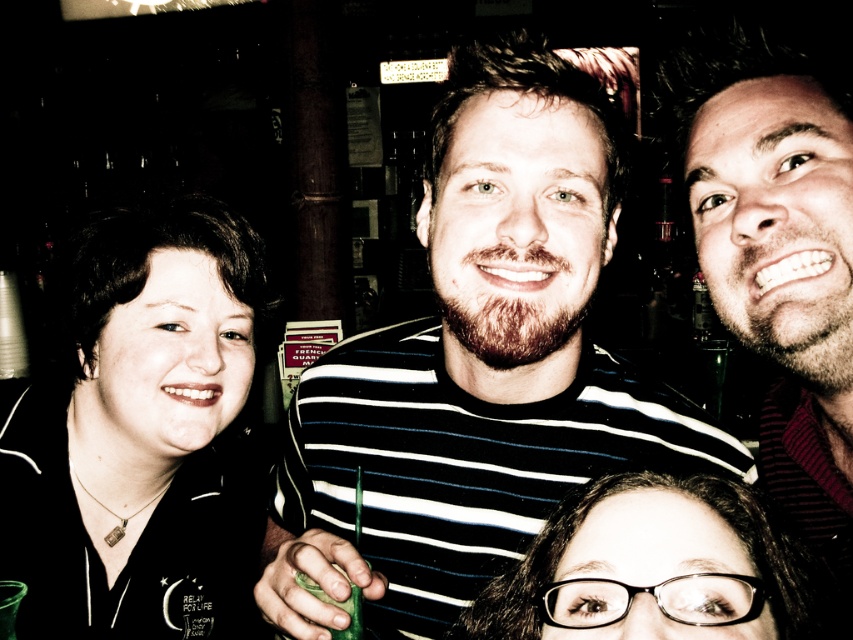
You are at a party and want to grab a drink. You see two glasses at the lower center of the table. The clear plastic glasses at lower center and the green matte glass at lower center. Which one is positioned higher and thus easier to reach?

The clear plastic glasses at lower center is above the green matte glass at lower center, so it is higher and easier to reach.

You are at a party and need to place a small decorative item on the table. The striped shirt at center is on the table, and the green matte glass at lower center is also there. Can you tell me which object takes up more space on the table?

The striped shirt at center has a larger size compared to the green matte glass at lower center, so the striped shirt at center takes up more space on the table.